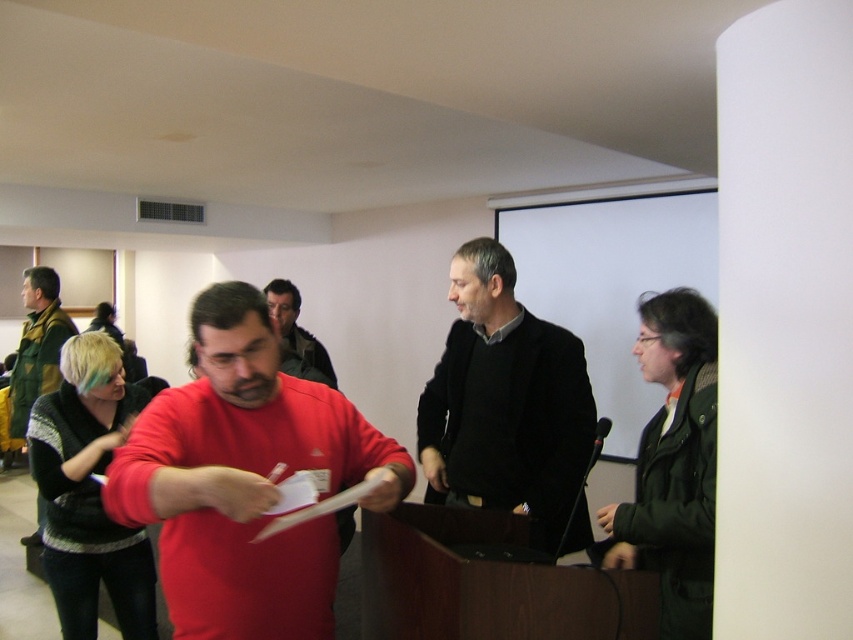
Question: Which of the following is the closest to the observer?

Choices:
 (A) matte red shirt at center
 (B) matte black jacket at center
 (C) black matte sweater at center
 (D) green textured jacket at left

Answer: (A)

Question: Can you confirm if green textured jacket at left is positioned below matte black jacket at center?

Choices:
 (A) no
 (B) yes

Answer: (B)

Question: Considering the real-world distances, which object is farthest from the dark green jacket at right?

Choices:
 (A) matte black jacket at center
 (B) green textured jacket at left
 (C) matte red shirt at center

Answer: (B)

Question: Which is nearer to the dark green jacket at right?

Choices:
 (A) black matte sweater at center
 (B) matte red shirt at center
 (C) green textured jacket at left
 (D) matte black jacket at center

Answer: (A)

Question: Is black matte sweater at center to the left of dark green jacket at right from the viewer's perspective?

Choices:
 (A) yes
 (B) no

Answer: (A)

Question: Can you confirm if black matte sweater at center is bigger than matte black jacket at center?

Choices:
 (A) yes
 (B) no

Answer: (A)